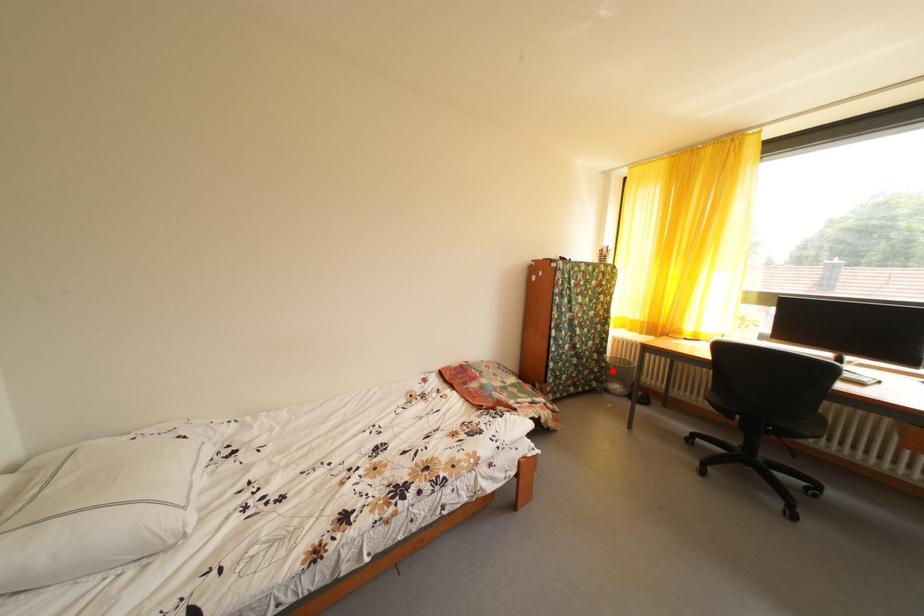
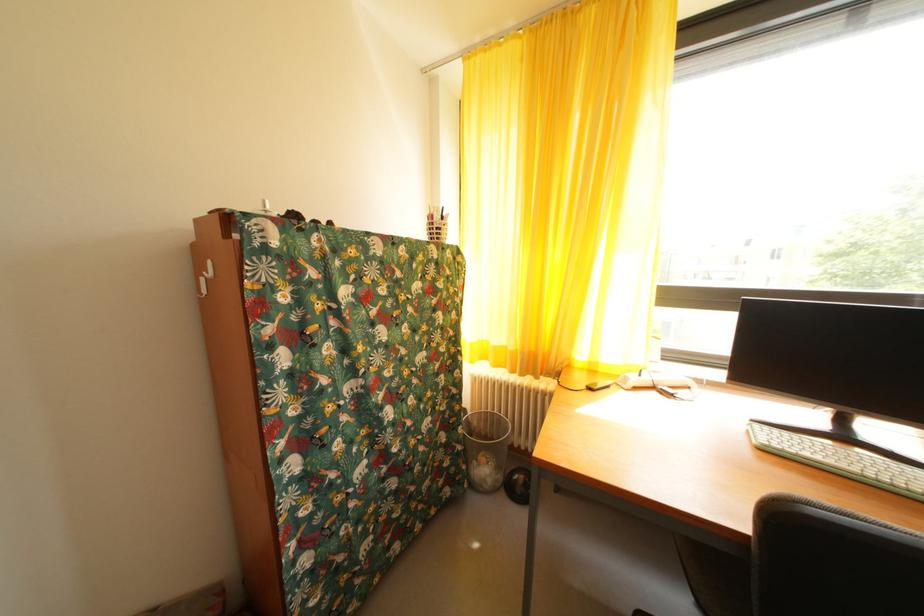
Question: A red point is marked in image1. In image2, is the corresponding 3D point closer to the camera or farther? Reply with the corresponding letter.

Choices:
 (A) The corresponding 3D point is closer.
 (B) The corresponding 3D point is farther.

Answer: (A)